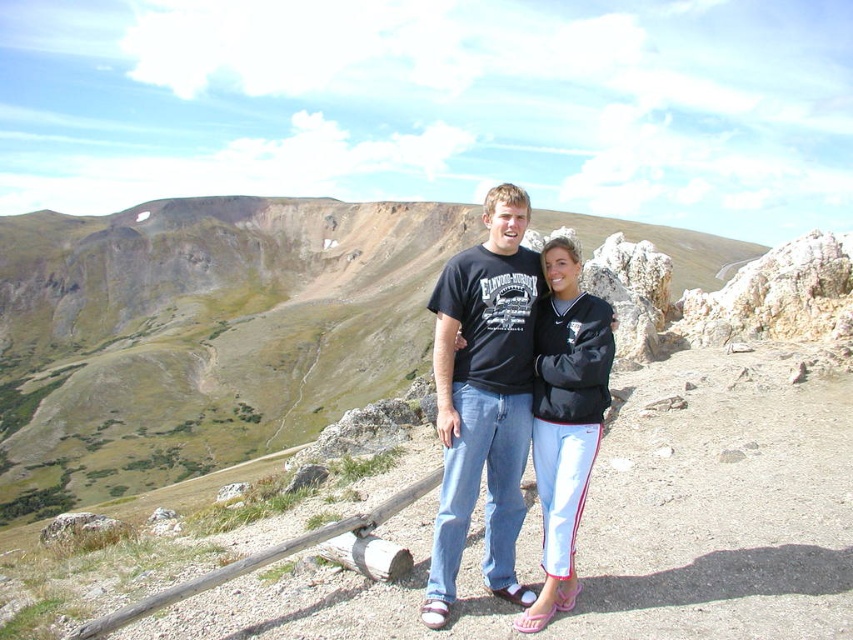
Is rocky terrain at center thinner than matte black t-shirt at center?

No.

Between rocky terrain at center and matte black t-shirt at center, which one has more height?

rocky terrain at center

The height and width of the screenshot is (640, 853). What do you see at coordinates (201, 333) in the screenshot?
I see `rocky terrain at center` at bounding box center [201, 333].

This screenshot has width=853, height=640. Find the location of `rocky terrain at center`. rocky terrain at center is located at coordinates (201, 333).

What do you see at coordinates (201, 333) in the screenshot? I see `rocky terrain at center` at bounding box center [201, 333].

Can you confirm if rocky terrain at center is positioned below black fleece jacket at center?

Incorrect, rocky terrain at center is not positioned below black fleece jacket at center.

Locate an element on the screen. This screenshot has width=853, height=640. rocky terrain at center is located at coordinates (201, 333).

Can you confirm if matte black t-shirt at center is bigger than black fleece jacket at center?

Indeed, matte black t-shirt at center has a larger size compared to black fleece jacket at center.

Is matte black t-shirt at center further to camera compared to black fleece jacket at center?

No.

Is point (457, 403) farther from camera compared to point (541, 426)?

Yes, point (457, 403) is farther from viewer.

The image size is (853, 640). I want to click on matte black t-shirt at center, so click(x=485, y=397).